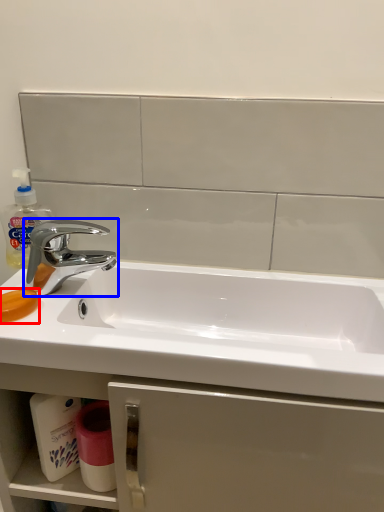
Question: Among these objects, which one is nearest to the camera, soap (highlighted by a red box) or tap (highlighted by a blue box)?

Choices:
 (A) soap
 (B) tap

Answer: (A)